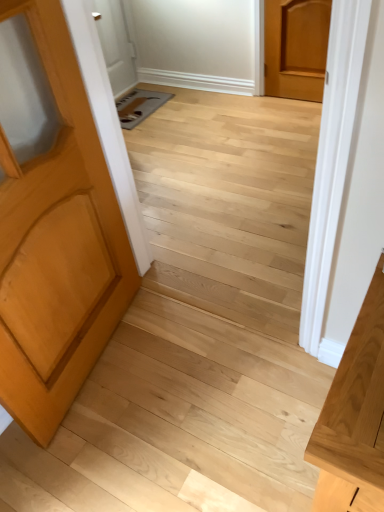
This screenshot has width=384, height=512. Identify the location of unoccupied area in front of light brown wood door at upper right, arranged as the first door when viewed from the top. (299, 108).